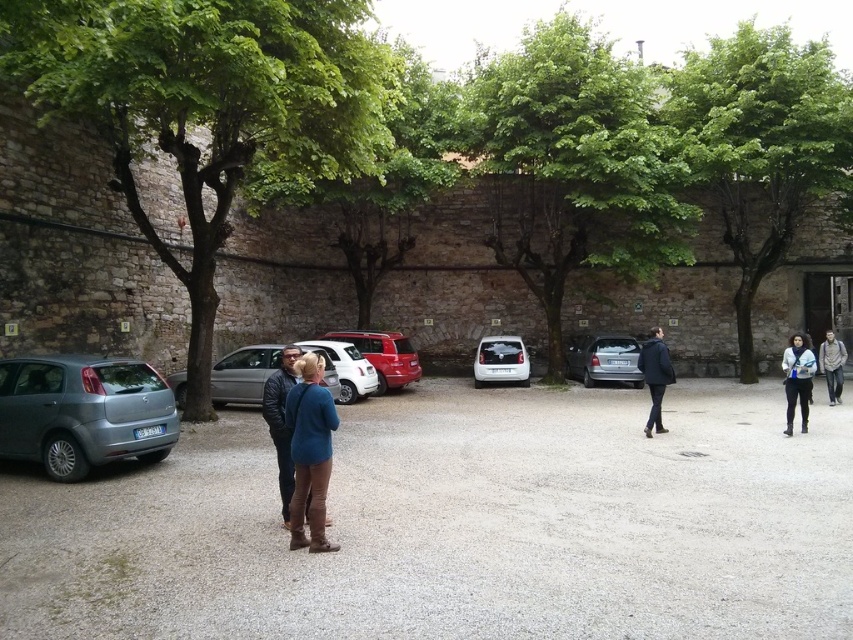
Does blue denim jacket at right have a greater height compared to dark blue jacket at right?

In fact, blue denim jacket at right may be shorter than dark blue jacket at right.

You are a GUI agent. You are given a task and a screenshot of the screen. Output one action in this format:
    pyautogui.click(x=<x>, y=<y>)
    Task: Click on the blue denim jacket at right
    This screenshot has width=853, height=640.
    Given the screenshot: What is the action you would take?
    pyautogui.click(x=798, y=380)

Locate an element on the screen. blue denim jacket at right is located at coordinates (798, 380).

Does satin silver hatchback at lower left appear on the right side of white matte car at center?

In fact, satin silver hatchback at lower left is to the left of white matte car at center.

Which is more to the left, satin silver hatchback at lower left or white matte car at center?

satin silver hatchback at lower left

This screenshot has height=640, width=853. In order to click on satin silver hatchback at lower left in this screenshot , I will do coord(83,412).

Which is in front, point (819, 93) or point (660, 433)?

Point (660, 433) is more forward.

Where is `green leafy tree at upper right`? Image resolution: width=853 pixels, height=640 pixels. green leafy tree at upper right is located at coordinates (761, 145).